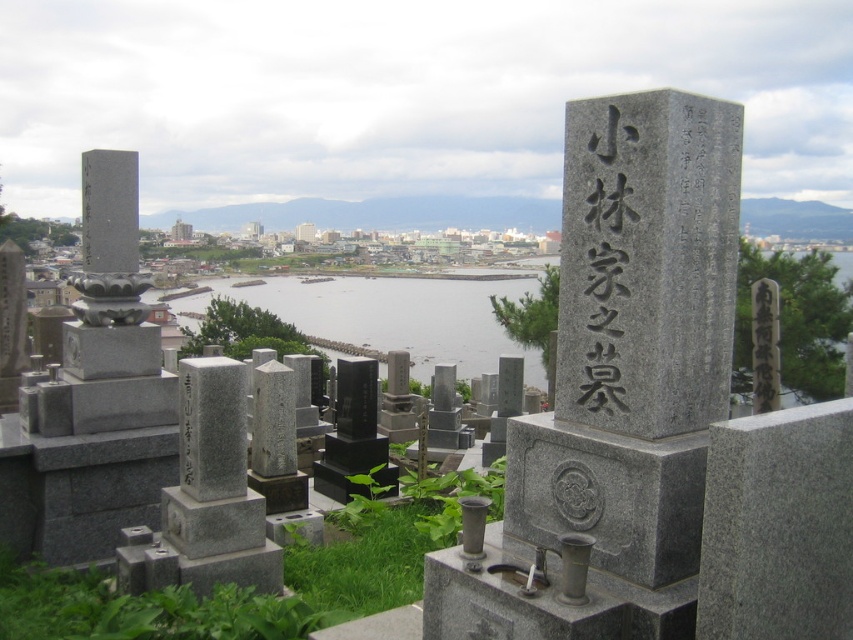
Who is lower down, gray stone monument at center or black stone inscription at center?

gray stone monument at center is lower down.

Is point (637, 220) positioned behind point (625, 291)?

No, (637, 220) is closer to viewer.

Locate an element on the screen. This screenshot has height=640, width=853. gray stone monument at center is located at coordinates (635, 333).

Does clear water at center have a smaller size compared to black stone inscription at center?

No, clear water at center is not smaller than black stone inscription at center.

Is clear water at center further to the viewer compared to black stone inscription at center?

Yes, clear water at center is further from the viewer.

Is point (416, 378) behind point (599, 324)?

Yes.

Identify the location of clear water at center. This screenshot has width=853, height=640. (390, 316).

Consider the image. Can you confirm if gray stone monument at center is thinner than clear water at center?

Indeed, gray stone monument at center has a lesser width compared to clear water at center.

Image resolution: width=853 pixels, height=640 pixels. Find the location of `gray stone monument at center`. gray stone monument at center is located at coordinates (635, 333).